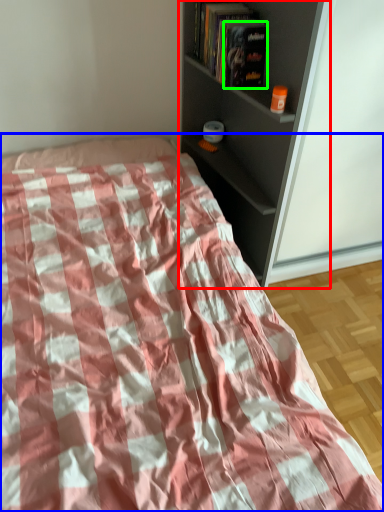
Question: Based on their relative distances, which object is farther from shelf (highlighted by a red box)? Choose from bed (highlighted by a blue box) and paperback book (highlighted by a green box).

Choices:
 (A) bed
 (B) paperback book

Answer: (A)